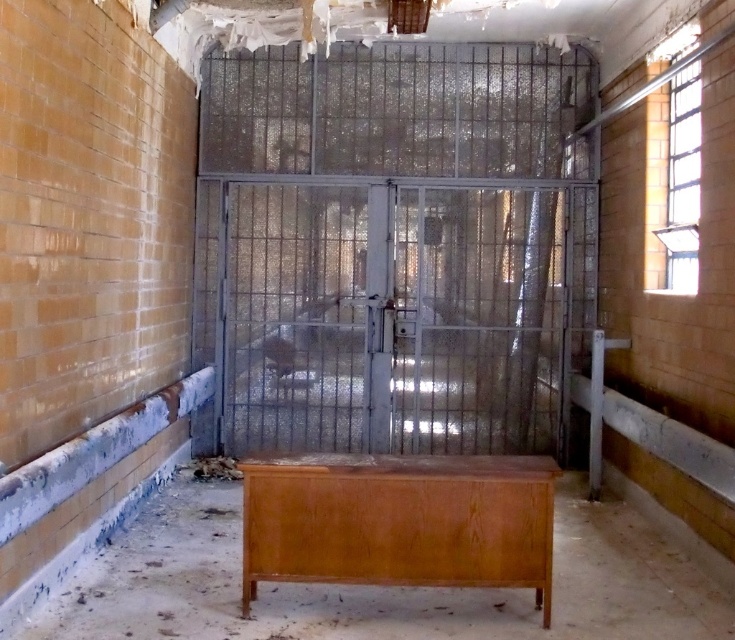
Between metallic wire cage at center and wooden cabinet at center, which one is positioned higher?

metallic wire cage at center is above.

Who is more distant from viewer, (516,260) or (345,547)?

The point (516,260) is more distant.

You are a GUI agent. You are given a task and a screenshot of the screen. Output one action in this format:
    pyautogui.click(x=<x>, y=<y>)
    Task: Click on the metallic wire cage at center
    Image resolution: width=735 pixels, height=640 pixels.
    Given the screenshot: What is the action you would take?
    395,246